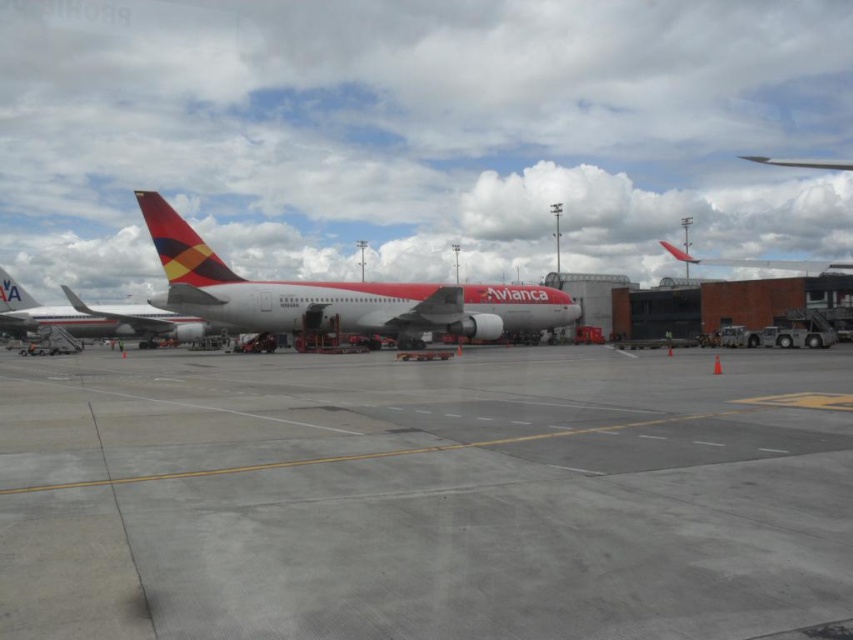
This screenshot has height=640, width=853. What do you see at coordinates (425, 496) in the screenshot?
I see `gray concrete tarmac at center` at bounding box center [425, 496].

Is point (535, 365) closer to viewer compared to point (271, 301)?

Yes, it is in front of point (271, 301).

At what (x,y) coordinates should I click in order to perform the action: click on gray concrete tarmac at center. Please return your answer as a coordinate pair (x, y). The height and width of the screenshot is (640, 853). Looking at the image, I should click on (425, 496).

Is matte red airplane at center further to camera compared to metallic red airplane at upper center?

Yes, matte red airplane at center is further from the viewer.

Between point (277, 314) and point (819, 273), which one is positioned behind?

Point (819, 273)

Where is `matte red airplane at center`? matte red airplane at center is located at coordinates (338, 294).

You are a GUI agent. You are given a task and a screenshot of the screen. Output one action in this format:
    pyautogui.click(x=<x>, y=<y>)
    Task: Click on the gray concrete tarmac at center
    The height and width of the screenshot is (640, 853).
    Given the screenshot: What is the action you would take?
    pyautogui.click(x=425, y=496)

Does gray concrete tarmac at center appear on the left side of metallic red airplane at upper center?

Correct, you'll find gray concrete tarmac at center to the left of metallic red airplane at upper center.

Who is more distant from viewer, (572, 522) or (671, 252)?

Point (671, 252)

Locate an element on the screen. Image resolution: width=853 pixels, height=640 pixels. gray concrete tarmac at center is located at coordinates (425, 496).